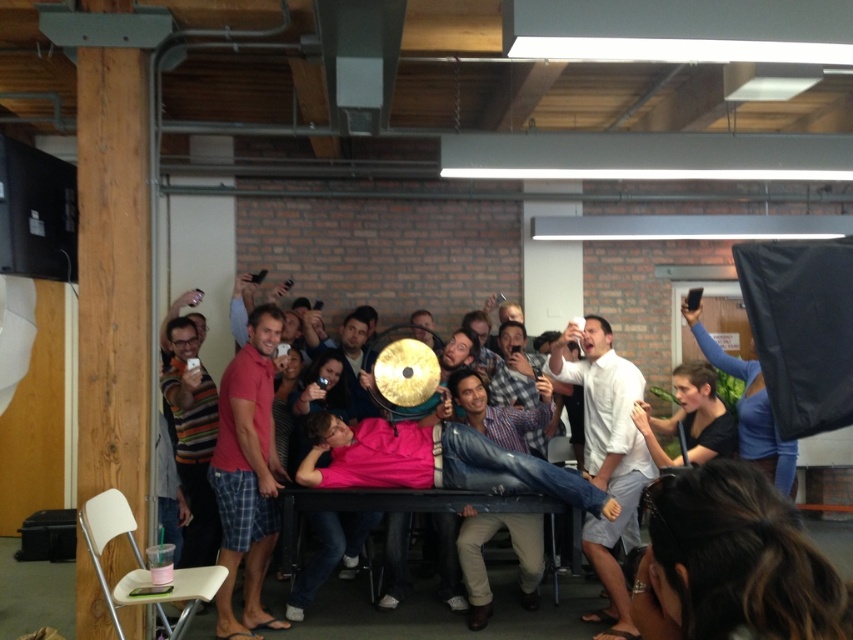
Who is positioned more to the right, white matte shirt at center or smooth black shirt at center?

From the viewer's perspective, smooth black shirt at center appears more on the right side.

In order to click on white matte shirt at center in this screenshot , I will do `click(607, 454)`.

Is point (236, 380) positioned behind point (689, 396)?

No, it is not.

Between red plaid shorts at left and smooth black shirt at center, which one is positioned lower?

red plaid shorts at left is below.

Is point (280, 332) farther from viewer compared to point (695, 372)?

No, (280, 332) is closer to viewer.

Locate an element on the screen. This screenshot has width=853, height=640. red plaid shorts at left is located at coordinates (247, 474).

Can you confirm if red plaid shorts at left is bigger than white matte shirt at center?

Actually, red plaid shorts at left might be smaller than white matte shirt at center.

Does point (219, 625) lie in front of point (619, 477)?

Yes, it is.

Where is `red plaid shorts at left`? The image size is (853, 640). red plaid shorts at left is located at coordinates (247, 474).